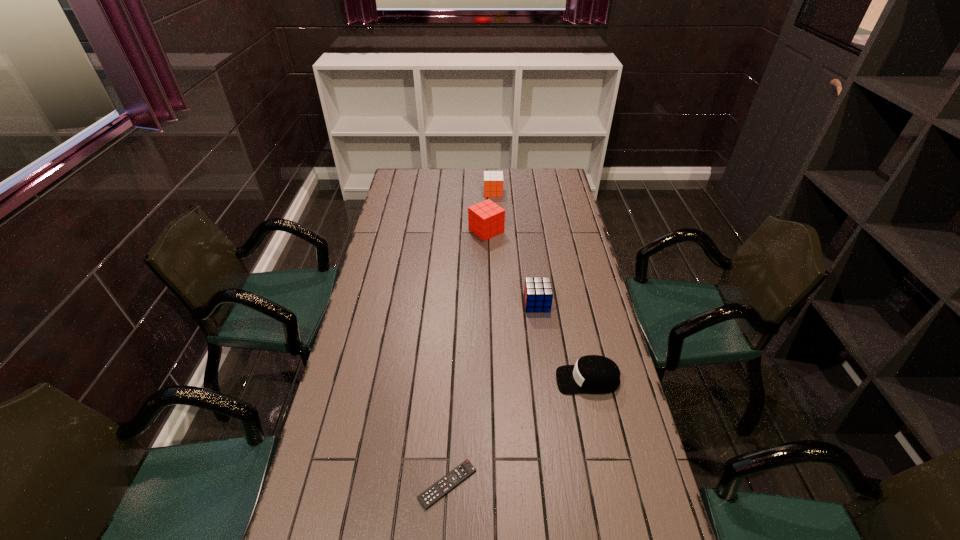
Find the location of a particular element. The image size is (960, 540). the tallest object is located at coordinates (486, 219).

Locate an element on the screen. the fourth nearest object is located at coordinates (486, 219).

At what (x,y) coordinates should I click in order to perform the action: click on the farthest cube. Please return your answer as a coordinate pair (x, y). Image resolution: width=960 pixels, height=540 pixels. Looking at the image, I should click on (493, 180).

This screenshot has width=960, height=540. I want to click on the nearest cube, so click(x=538, y=294).

Where is `the rightmost cube`? This screenshot has height=540, width=960. the rightmost cube is located at coordinates (538, 294).

Where is `the fourth farthest object`? The height and width of the screenshot is (540, 960). the fourth farthest object is located at coordinates (592, 374).

Locate an element on the screen. This screenshot has height=540, width=960. the shortest object is located at coordinates (430, 496).

The width and height of the screenshot is (960, 540). I want to click on remote control, so click(430, 496).

The width and height of the screenshot is (960, 540). Find the location of `vacant position located 0.140m on the back of the tallest cube`. vacant position located 0.140m on the back of the tallest cube is located at coordinates (486, 204).

Find the location of `free point located 0.240m on the left of the farthest object`. free point located 0.240m on the left of the farthest object is located at coordinates (436, 192).